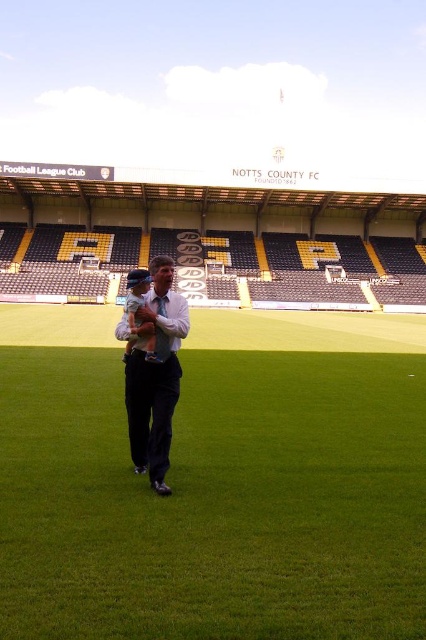
You are a photographer at Notts County Football Club. You need to capture a wide shot of the stadium field. Which object, the green artificial turf at center or the white shirt at center, will occupy more space in your photo?

The green artificial turf at center is bigger than the white shirt at center, so it will occupy more space in the photo.

You are a spectator at Notts County Football Club and want to walk from the entrance to the green artificial turf at center without stepping on the white shirt at center. Is there a path available to your left or right?

The green artificial turf at center is to the right of the white shirt at center, so you can walk to the left of the white shirt at center to reach the green artificial turf at center without stepping on it.

You are a spectator at Notts County Football Club and want to take a photo of the two points mentioned in the scene. Which point, point (138, 385) or point (131, 346), is closer to you?

Point (138, 385) is closer to the viewer than point (131, 346).